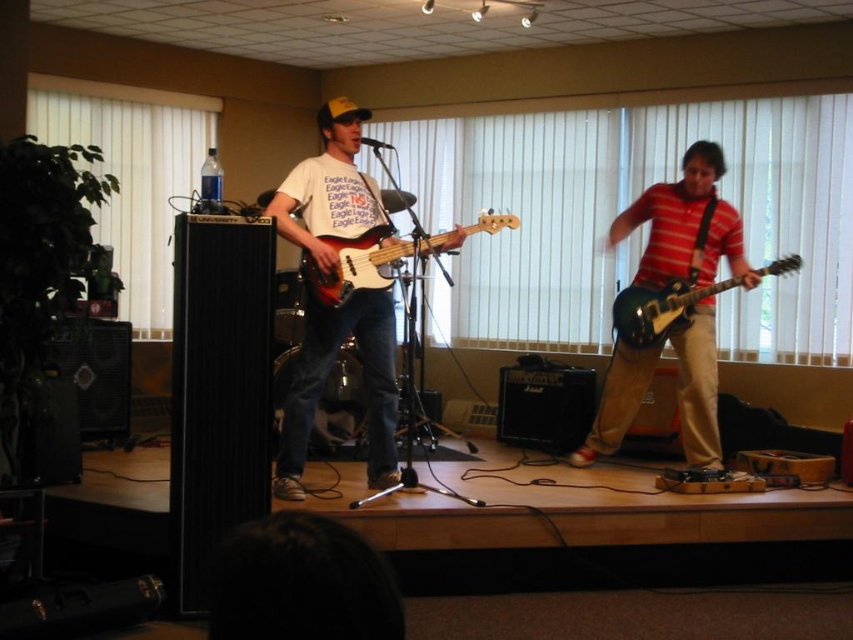
Between point (318, 269) and point (675, 326), which one is positioned behind?

The point (675, 326) is behind.

Is glossy wood bass guitar at center taller than glossy green electric guitar at right?

In fact, glossy wood bass guitar at center may be shorter than glossy green electric guitar at right.

Does point (339, 266) come farther from viewer compared to point (798, 266)?

No, it is not.

Where is `glossy wood bass guitar at center`? glossy wood bass guitar at center is located at coordinates (363, 262).

From the picture: Does matte white t-shirt at center lie behind glossy green electric guitar at right?

No, it is in front of glossy green electric guitar at right.

Is point (346, 188) positioned in front of point (648, 332)?

Yes, it is in front of point (648, 332).

This screenshot has width=853, height=640. I want to click on matte white t-shirt at center, so click(326, 376).

Based on the photo, can you confirm if green glossy electric guitar at center is shorter than glossy green electric guitar at right?

No, green glossy electric guitar at center is not shorter than glossy green electric guitar at right.

This screenshot has height=640, width=853. Identify the location of green glossy electric guitar at center. (686, 225).

Find the location of a particular element. The image size is (853, 640). green glossy electric guitar at center is located at coordinates (686, 225).